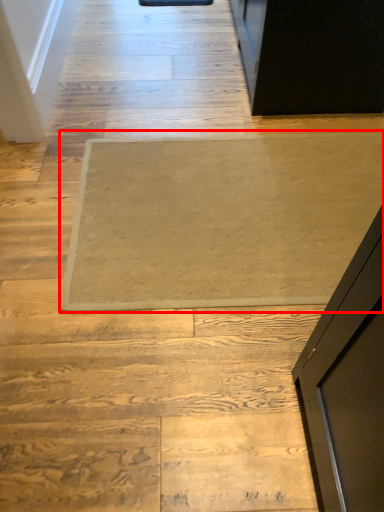
Question: From the image's perspective, what is the correct spatial positioning of mat (annotated by the red box) in reference to stairwell?

Choices:
 (A) below
 (B) above

Answer: (A)